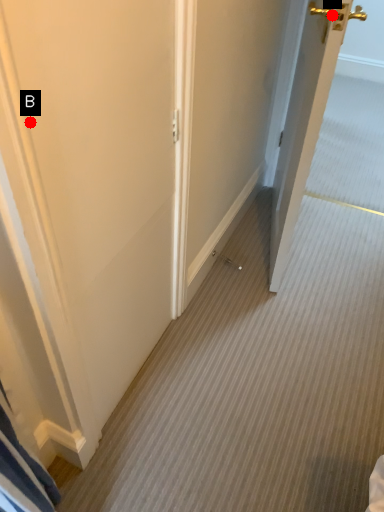
Question: Two points are circled on the image, labeled by A and B beside each circle. Which of the following is the closest to the observer?

Choices:
 (A) A is closer
 (B) B is closer

Answer: (B)